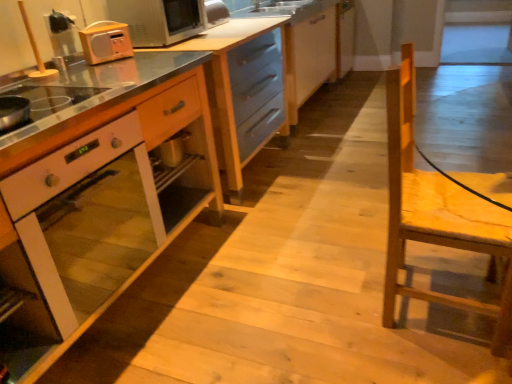
What do you see at coordinates (159, 20) in the screenshot? I see `metallic silver microwave at upper left` at bounding box center [159, 20].

What is the approximate width of metallic silver microwave at upper left?

14.60 inches.

This screenshot has width=512, height=384. What do you see at coordinates (96, 192) in the screenshot? I see `wooden cabinet at center, which is the second cabinetry from left to right` at bounding box center [96, 192].

What do you see at coordinates (309, 53) in the screenshot? I see `wooden cabinet at center, arranged as the 1th cabinetry when viewed from the right` at bounding box center [309, 53].

In order to face wooden cabinet at center, positioned as the 3th cabinetry in left-to-right order, should I rotate leftwards or rightwards?

It's best to rotate right around 8.351 degrees.

Locate an element on the screen. The width and height of the screenshot is (512, 384). matte blue cabinet at center, arranged as the first cabinetry when viewed from the left is located at coordinates click(312, 44).

Describe the element at coordinates (441, 210) in the screenshot. This screenshot has height=384, width=512. I see `light brown wooden chair at right` at that location.

Identify the location of stainless steel countertop at center. Image resolution: width=512 pixels, height=384 pixels. (232, 92).

Locate an element on the screen. This screenshot has width=512, height=384. white glossy oven at center is located at coordinates (101, 202).

Where is `metallic silver microwave at upper left`? The width and height of the screenshot is (512, 384). metallic silver microwave at upper left is located at coordinates (159, 20).

At what (x,y) coordinates should I click in order to perform the action: click on cabinetry that is the 3rd object directly below the matte orange radio at upper left (from a real-world perspective). Please return your answer as a coordinate pair (x, y). Looking at the image, I should click on pos(96,192).

Is matte orange radio at upper left touching wooden cabinet at center, which is the second cabinetry in right-to-left order?

No, matte orange radio at upper left is not touching wooden cabinet at center, which is the second cabinetry in right-to-left order.

Is point (98, 38) closer or farther from the camera than point (177, 58)?

Point (98, 38) is positioned closer to the camera compared to point (177, 58).

Identify the location of cabinetry that is the 1st object located behind the metallic silver microwave at upper left. (312, 44).

From the image's perspective, is metallic silver microwave at upper left located above or below matte blue cabinet at center, marked as the 3th cabinetry in a right-to-left arrangement?

Clearly, from the image's perspective, metallic silver microwave at upper left is below matte blue cabinet at center, marked as the 3th cabinetry in a right-to-left arrangement.

Which object is thinner, metallic silver microwave at upper left or matte blue cabinet at center, arranged as the first cabinetry when viewed from the left?

With smaller width is metallic silver microwave at upper left.

What's the angular difference between metallic silver microwave at upper left and matte blue cabinet at center, marked as the 3th cabinetry in a right-to-left arrangement,'s facing directions?

The angular difference between metallic silver microwave at upper left and matte blue cabinet at center, marked as the 3th cabinetry in a right-to-left arrangement, is 0.611 degrees.

What's the angular difference between metallic silver microwave at upper left and light brown wooden chair at right's facing directions?

The angular difference between metallic silver microwave at upper left and light brown wooden chair at right is 0.362 degrees.

Which is in front, point (186, 21) or point (412, 205)?

Point (412, 205)

Which is in front, metallic silver microwave at upper left or light brown wooden chair at right?

light brown wooden chair at right is more forward.

Is metallic silver microwave at upper left beside light brown wooden chair at right?

metallic silver microwave at upper left and light brown wooden chair at right are clearly separated.

Find the location of a particular element. The height and width of the screenshot is (384, 512). counter top on the right side of metallic silver microwave at upper left is located at coordinates (232, 92).

Between metallic silver microwave at upper left and stainless steel countertop at center, which one has more height?

stainless steel countertop at center.

From the image's perspective, is metallic silver microwave at upper left above or below stainless steel countertop at center?

metallic silver microwave at upper left is above stainless steel countertop at center.

Is metallic silver microwave at upper left outside of stainless steel countertop at center?

Indeed, metallic silver microwave at upper left is completely outside stainless steel countertop at center.

From the image's perspective, is light brown wooden chair at right above wooden cabinet at center, arranged as the 1th cabinetry when viewed from the right?

No, from the image's perspective, light brown wooden chair at right is not on top of wooden cabinet at center, arranged as the 1th cabinetry when viewed from the right.

Is light brown wooden chair at right shorter than wooden cabinet at center, arranged as the 1th cabinetry when viewed from the right?

Incorrect, the height of light brown wooden chair at right does not fall short of that of wooden cabinet at center, arranged as the 1th cabinetry when viewed from the right.

Measure the distance from light brown wooden chair at right to wooden cabinet at center, positioned as the 3th cabinetry in left-to-right order.

light brown wooden chair at right is 5.97 feet away from wooden cabinet at center, positioned as the 3th cabinetry in left-to-right order.

Does light brown wooden chair at right have a greater width compared to wooden cabinet at center, positioned as the 3th cabinetry in left-to-right order?

In fact, light brown wooden chair at right might be narrower than wooden cabinet at center, positioned as the 3th cabinetry in left-to-right order.

Is matte blue cabinet at center, marked as the 3th cabinetry in a right-to-left arrangement, positioned with its back to wooden cabinet at center, which is the second cabinetry from left to right?

That's not correct — matte blue cabinet at center, marked as the 3th cabinetry in a right-to-left arrangement, is not looking away from wooden cabinet at center, which is the second cabinetry from left to right.

Would you say wooden cabinet at center, which is the second cabinetry from left to right, is part of matte blue cabinet at center, marked as the 3th cabinetry in a right-to-left arrangement,'s contents?

No, matte blue cabinet at center, marked as the 3th cabinetry in a right-to-left arrangement, does not contain wooden cabinet at center, which is the second cabinetry from left to right.

Between point (329, 29) and point (124, 266), which one is positioned behind?

The point (329, 29) is more distant.

From a real-world perspective, which object stands above the other?

matte blue cabinet at center, marked as the 3th cabinetry in a right-to-left arrangement.

Considering the sizes of objects matte blue cabinet at center, arranged as the first cabinetry when viewed from the left, and wooden cabinet at center, positioned as the 3th cabinetry in left-to-right order, in the image provided, who is shorter, matte blue cabinet at center, arranged as the first cabinetry when viewed from the left, or wooden cabinet at center, positioned as the 3th cabinetry in left-to-right order,?

Standing shorter between the two is wooden cabinet at center, positioned as the 3th cabinetry in left-to-right order.

Is the position of matte blue cabinet at center, marked as the 3th cabinetry in a right-to-left arrangement, more distant than that of wooden cabinet at center, positioned as the 3th cabinetry in left-to-right order?

No.

Is matte blue cabinet at center, marked as the 3th cabinetry in a right-to-left arrangement, directly adjacent to wooden cabinet at center, arranged as the 1th cabinetry when viewed from the right?

Indeed, matte blue cabinet at center, marked as the 3th cabinetry in a right-to-left arrangement, and wooden cabinet at center, arranged as the 1th cabinetry when viewed from the right, are beside each other and touching.

The height and width of the screenshot is (384, 512). Find the location of `the 2nd cabinetry counting from the right side of the matte blue cabinet at center, marked as the 3th cabinetry in a right-to-left arrangement`. the 2nd cabinetry counting from the right side of the matte blue cabinet at center, marked as the 3th cabinetry in a right-to-left arrangement is located at coordinates (309, 53).

Where is `cabinetry in front of the matte orange radio at upper left`? This screenshot has width=512, height=384. cabinetry in front of the matte orange radio at upper left is located at coordinates (96, 192).

Where is `appliance to the left of matte blue cabinet at center, marked as the 3th cabinetry in a right-to-left arrangement`? appliance to the left of matte blue cabinet at center, marked as the 3th cabinetry in a right-to-left arrangement is located at coordinates (159, 20).

Estimate the real-world distances between objects in this image. Which object is closer to light brown wooden chair at right, matte orange radio at upper left or metallic silver microwave at upper left?

Among the two, metallic silver microwave at upper left is located nearer to light brown wooden chair at right.

In the scene shown: Looking at the image, which one is located closer to metallic silver microwave at upper left, wooden cabinet at center, which is the second cabinetry from left to right, or stainless steel countertop at center?

Among the two, stainless steel countertop at center is located nearer to metallic silver microwave at upper left.

Estimate the real-world distances between objects in this image. Which object is further from light brown wooden chair at right, metallic silver microwave at upper left or wooden cabinet at center, positioned as the 3th cabinetry in left-to-right order?

wooden cabinet at center, positioned as the 3th cabinetry in left-to-right order, lies further to light brown wooden chair at right than the other object.

When comparing their distances from white glossy oven at center, does wooden cabinet at center, which is the second cabinetry from left to right, or wooden cabinet at center, positioned as the 3th cabinetry in left-to-right order, seem further?

wooden cabinet at center, positioned as the 3th cabinetry in left-to-right order, lies further to white glossy oven at center than the other object.

Based on their spatial positions, is matte orange radio at upper left or wooden cabinet at center, which is the second cabinetry from left to right, closer to metallic silver microwave at upper left?

Among the two, matte orange radio at upper left is located nearer to metallic silver microwave at upper left.

Looking at this image, estimate the real-world distances between objects in this image. Which object is further from wooden cabinet at center, which is the second cabinetry in right-to-left order, wooden cabinet at center, positioned as the 3th cabinetry in left-to-right order, or white glossy oven at center?

The object further to wooden cabinet at center, which is the second cabinetry in right-to-left order, is wooden cabinet at center, positioned as the 3th cabinetry in left-to-right order.

Looking at the image, which one is located closer to stainless steel countertop at center, white glossy oven at center or wooden cabinet at center, positioned as the 3th cabinetry in left-to-right order?

white glossy oven at center is closer to stainless steel countertop at center.

When comparing their distances from stainless steel countertop at center, does matte blue cabinet at center, marked as the 3th cabinetry in a right-to-left arrangement, or matte orange radio at upper left seem further?

matte blue cabinet at center, marked as the 3th cabinetry in a right-to-left arrangement.

The height and width of the screenshot is (384, 512). I want to click on cabinetry between white glossy oven at center and wooden cabinet at center, arranged as the 1th cabinetry when viewed from the right, from front to back, so click(x=312, y=44).

You are a GUI agent. You are given a task and a screenshot of the screen. Output one action in this format:
    pyautogui.click(x=<x>, y=<y>)
    Task: Click on the counter top positioned between light brown wooden chair at right and wooden cabinet at center, positioned as the 3th cabinetry in left-to-right order, from near to far
    The width and height of the screenshot is (512, 384).
    Given the screenshot: What is the action you would take?
    pyautogui.click(x=232, y=92)

Where is `cabinetry between wooden cabinet at center, which is the second cabinetry in right-to-left order, and wooden cabinet at center, arranged as the 1th cabinetry when viewed from the right, from front to back`? Image resolution: width=512 pixels, height=384 pixels. cabinetry between wooden cabinet at center, which is the second cabinetry in right-to-left order, and wooden cabinet at center, arranged as the 1th cabinetry when viewed from the right, from front to back is located at coordinates (312, 44).

Locate an element on the screen. The width and height of the screenshot is (512, 384). appliance between wooden cabinet at center, which is the second cabinetry in right-to-left order, and wooden cabinet at center, arranged as the 1th cabinetry when viewed from the right, along the z-axis is located at coordinates (159, 20).